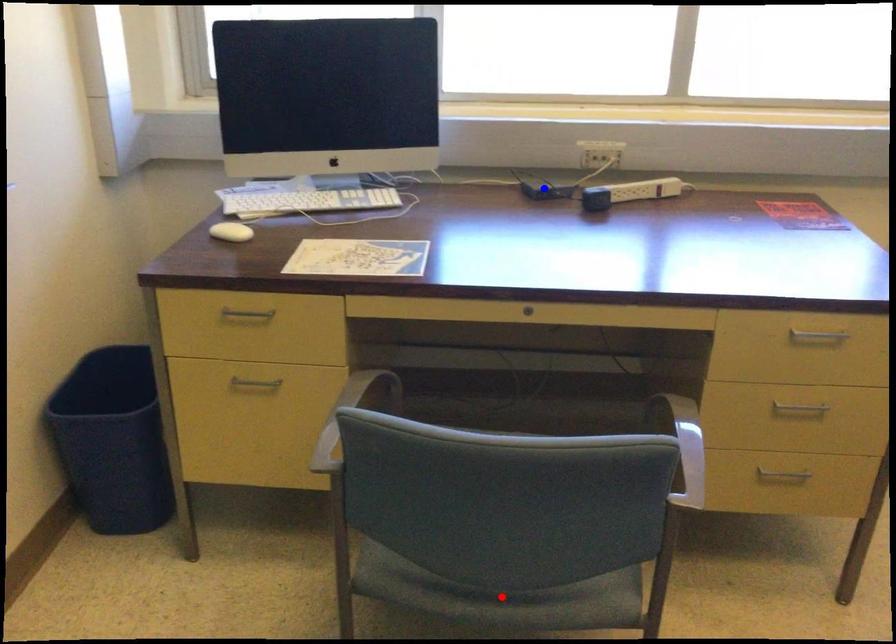
Question: Which of the two points in the image is closer to the camera?

Choices:
 (A) Blue point is closer.
 (B) Red point is closer.

Answer: (B)